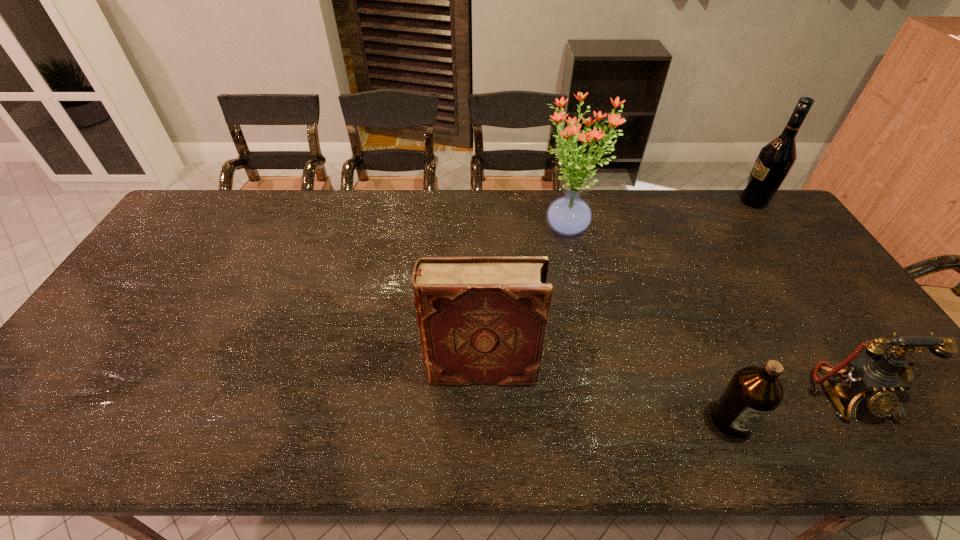
Identify the location of free space between the flower arrangement and the wine bottle. This screenshot has width=960, height=540. (660, 214).

Where is `empty location between the telephone and the leftmost object`? Image resolution: width=960 pixels, height=540 pixels. empty location between the telephone and the leftmost object is located at coordinates (665, 382).

Locate an element on the screen. empty location between the telephone and the olive oil is located at coordinates coord(790,408).

You are a GUI agent. You are given a task and a screenshot of the screen. Output one action in this format:
    pyautogui.click(x=<x>, y=<y>)
    Task: Click on the free spot between the olive oil and the leftmost object
    
    Given the screenshot: What is the action you would take?
    pyautogui.click(x=606, y=395)

Identify the location of object that ranks as the closest to the telephone. The image size is (960, 540). (753, 393).

The image size is (960, 540). I want to click on object that is the third closest to the olive oil, so click(x=569, y=215).

You are a GUI agent. You are given a task and a screenshot of the screen. Output one action in this format:
    pyautogui.click(x=<x>, y=<y>)
    Task: Click on the free location that satisfies the following two spatial constraints: 1. on the label of the wine bottle; 2. on the front of the telephone, featuring the rotary dial
    
    Given the screenshot: What is the action you would take?
    pyautogui.click(x=892, y=395)

You are a GUI agent. You are given a task and a screenshot of the screen. Output one action in this format:
    pyautogui.click(x=<x>, y=<y>)
    Task: Click on the free space in the image that satisfies the following two spatial constraints: 1. on the label of the wine bottle; 2. on the label of the third object from left to right
    Image resolution: width=960 pixels, height=540 pixels.
    Given the screenshot: What is the action you would take?
    pyautogui.click(x=910, y=421)

What are the coordinates of `free space that satisfies the following two spatial constraints: 1. on the label of the wine bottle; 2. on the label of the olive oil` in the screenshot? It's located at (910, 421).

Image resolution: width=960 pixels, height=540 pixels. I want to click on vacant space that satisfies the following two spatial constraints: 1. on the label of the wine bottle; 2. on the front of the telephone, featuring the rotary dial, so click(x=892, y=395).